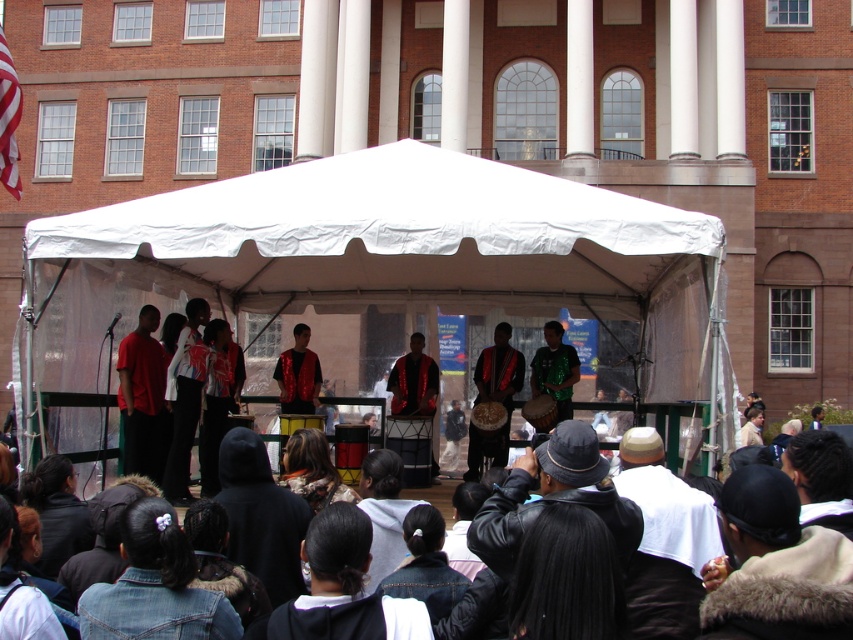
Is white fabric canopy at center shorter than shiny green sequined shirt at center?

No, white fabric canopy at center is not shorter than shiny green sequined shirt at center.

The image size is (853, 640). Describe the element at coordinates (398, 234) in the screenshot. I see `white fabric canopy at center` at that location.

Is point (354, 241) more distant than point (567, 388)?

No, it is not.

This screenshot has height=640, width=853. Identify the location of white fabric canopy at center. 398,234.

Can you confirm if matte red shirt at left is thinner than matte red drum at center?

Incorrect, matte red shirt at left's width is not less than matte red drum at center's.

Who is shorter, matte red shirt at left or matte red drum at center?

Standing shorter between the two is matte red drum at center.

You are a GUI agent. You are given a task and a screenshot of the screen. Output one action in this format:
    pyautogui.click(x=<x>, y=<y>)
    Task: Click on the matte red shirt at left
    
    Given the screenshot: What is the action you would take?
    pyautogui.click(x=142, y=397)

Identify the location of matte red shirt at left. (142, 397).

Does matte red shirt at left lie behind shiny green sequined shirt at center?

No, it is in front of shiny green sequined shirt at center.

Is matte red shirt at left below shiny green sequined shirt at center?

Yes, matte red shirt at left is below shiny green sequined shirt at center.

Is point (138, 390) less distant than point (546, 380)?

Yes.

Where is `matte red shirt at left`? matte red shirt at left is located at coordinates (142, 397).